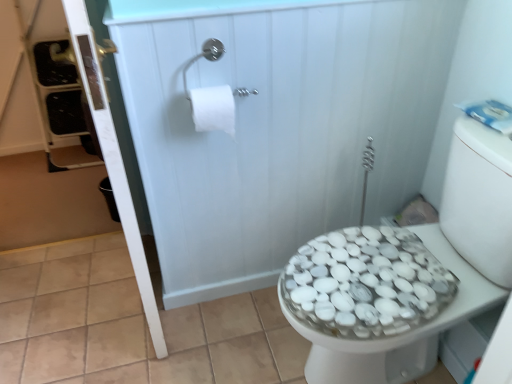
Question: Should I look upward or downward to see white glossy shower door at upper left?

Choices:
 (A) up
 (B) down

Answer: (A)

Question: From the image's perspective, is white matte toilet paper at upper center under white pebble-patterned bidet at right?

Choices:
 (A) yes
 (B) no

Answer: (B)

Question: Are white matte toilet paper at upper center and white pebble-patterned bidet at right located far from each other?

Choices:
 (A) no
 (B) yes

Answer: (A)

Question: Is white matte toilet paper at upper center oriented towards white pebble-patterned bidet at right?

Choices:
 (A) yes
 (B) no

Answer: (B)

Question: Considering the relative sizes of white matte toilet paper at upper center and white pebble-patterned bidet at right in the image provided, is white matte toilet paper at upper center thinner than white pebble-patterned bidet at right?

Choices:
 (A) yes
 (B) no

Answer: (A)

Question: Is white matte toilet paper at upper center smaller than white pebble-patterned bidet at right?

Choices:
 (A) no
 (B) yes

Answer: (B)

Question: Considering the relative positions of white matte toilet paper at upper center and white pebble-patterned bidet at right in the image provided, is white matte toilet paper at upper center to the right of white pebble-patterned bidet at right from the viewer's perspective?

Choices:
 (A) yes
 (B) no

Answer: (B)

Question: Can you confirm if white pebble-patterned bidet at right is smaller than white matte toilet paper at upper center?

Choices:
 (A) no
 (B) yes

Answer: (A)

Question: Could you tell me if white pebble-patterned bidet at right is turned towards white matte toilet paper at upper center?

Choices:
 (A) yes
 (B) no

Answer: (B)

Question: Considering the relative sizes of white pebble-patterned bidet at right and white matte toilet paper at upper center in the image provided, is white pebble-patterned bidet at right shorter than white matte toilet paper at upper center?

Choices:
 (A) yes
 (B) no

Answer: (B)

Question: Is white pebble-patterned bidet at right located outside white matte toilet paper at upper center?

Choices:
 (A) yes
 (B) no

Answer: (A)

Question: Can you confirm if white pebble-patterned bidet at right is taller than white matte toilet paper at upper center?

Choices:
 (A) no
 (B) yes

Answer: (B)

Question: From the image's perspective, is white pebble-patterned bidet at right on white matte toilet paper at upper center?

Choices:
 (A) no
 (B) yes

Answer: (A)

Question: Is the surface of white glossy shower door at upper left in direct contact with white matte toilet paper at upper center?

Choices:
 (A) no
 (B) yes

Answer: (A)